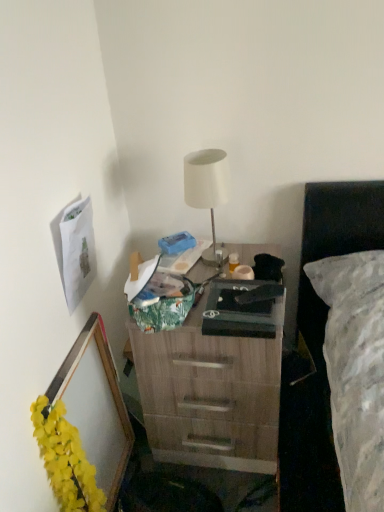
Question: Is white matte lamp at center not close to wooden desk at center?

Choices:
 (A) yes
 (B) no

Answer: (B)

Question: From a real-world perspective, is white matte lamp at center on top of wooden desk at center?

Choices:
 (A) yes
 (B) no

Answer: (A)

Question: Is white matte lamp at center completely or partially outside of wooden desk at center?

Choices:
 (A) yes
 (B) no

Answer: (A)

Question: Is white matte lamp at center oriented towards wooden desk at center?

Choices:
 (A) no
 (B) yes

Answer: (A)

Question: Is white matte lamp at center wider than wooden desk at center?

Choices:
 (A) no
 (B) yes

Answer: (A)

Question: Can you confirm if white matte lamp at center is taller than wooden desk at center?

Choices:
 (A) no
 (B) yes

Answer: (A)

Question: Could matte black box at center be considered to be inside yellow fabric garland at lower left?

Choices:
 (A) yes
 (B) no

Answer: (B)

Question: Can you confirm if yellow fabric garland at lower left is shorter than matte black box at center?

Choices:
 (A) no
 (B) yes

Answer: (A)

Question: Can you confirm if yellow fabric garland at lower left is smaller than matte black box at center?

Choices:
 (A) no
 (B) yes

Answer: (A)

Question: Is yellow fabric garland at lower left positioned in front of matte black box at center?

Choices:
 (A) yes
 (B) no

Answer: (A)

Question: Does yellow fabric garland at lower left have a larger size compared to matte black box at center?

Choices:
 (A) yes
 (B) no

Answer: (A)

Question: Is yellow fabric garland at lower left facing towards matte black box at center?

Choices:
 (A) no
 (B) yes

Answer: (A)

Question: Is wooden picture frame at lower left at the left side of white matte lamp at center?

Choices:
 (A) no
 (B) yes

Answer: (B)